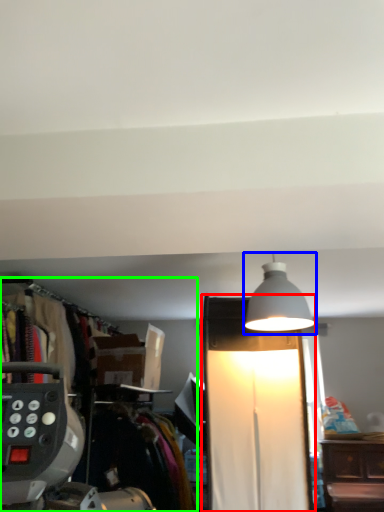
Question: Which object is positioned farthest from lamp (highlighted by a red box)? Select from lamp (highlighted by a blue box) and closet (highlighted by a green box).

Choices:
 (A) lamp
 (B) closet

Answer: (B)